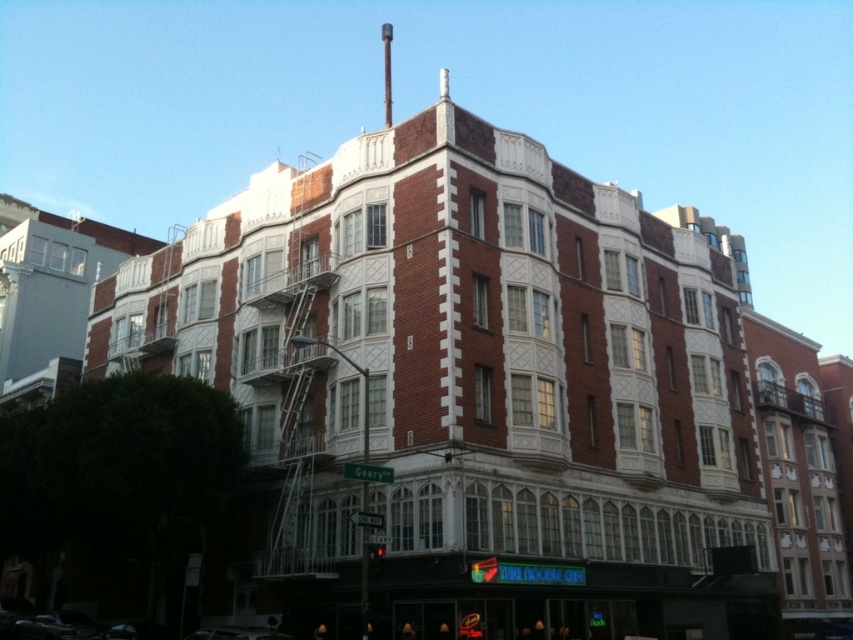
You are a photographer planning to capture the red brick building at center and the shiny silver car at lower left in a single frame. Which object should you focus on first to ensure both are in the frame without moving the camera?

The red brick building at center is wider than the shiny silver car at lower left, so you should focus on the red brick building at center first to ensure both fit in the frame.